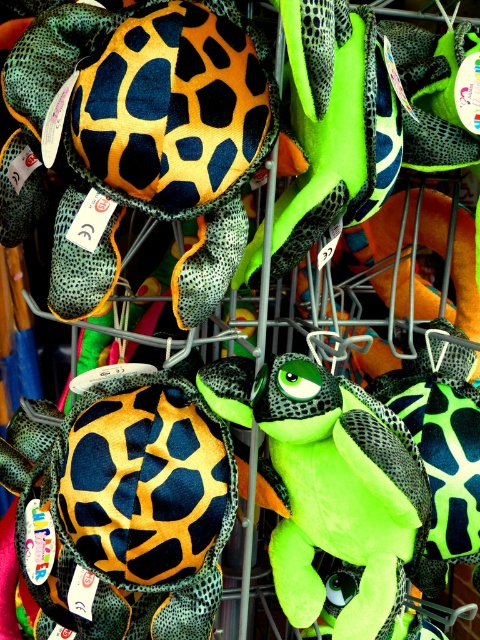
Question: Which of the following is the farthest from the observer?

Choices:
 (A) (48, 156)
 (B) (364, 452)
 (C) (120, 604)

Answer: (C)

Question: Which point appears farthest from the camera in this image?

Choices:
 (A) (186, 481)
 (B) (17, 106)
 (C) (310, 554)

Answer: (C)

Question: Is matte orange and black plush turtle at center below matte black plush turtle at center?

Choices:
 (A) no
 (B) yes

Answer: (A)

Question: Is matte orange and black plush turtle at center below matte black plush turtle at center?

Choices:
 (A) yes
 (B) no

Answer: (B)

Question: Is matte black plush turtle at center positioned behind neon green plush turtle at center?

Choices:
 (A) no
 (B) yes

Answer: (B)

Question: Which point is farther to the camera?

Choices:
 (A) neon green plush turtle at center
 (B) matte black plush turtle at center

Answer: (B)